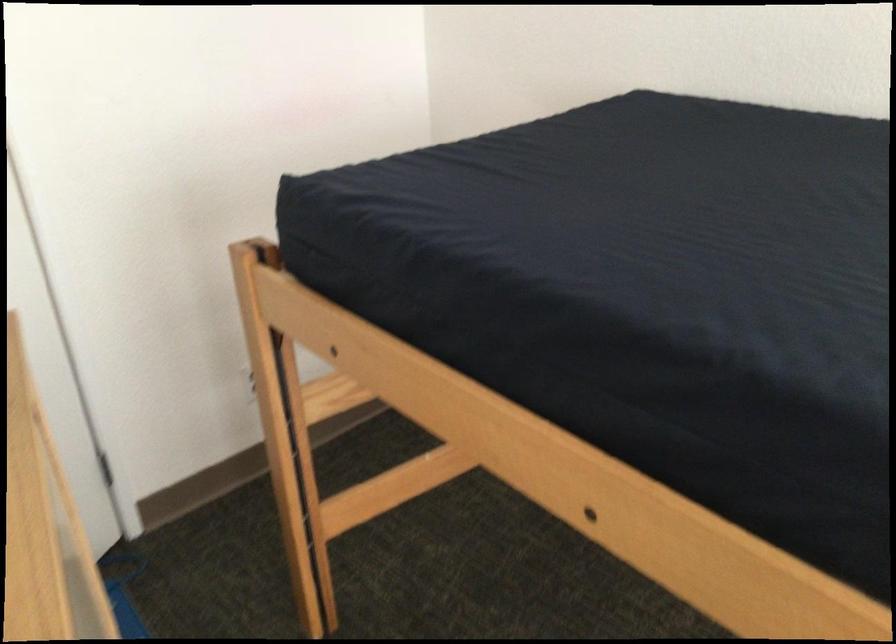
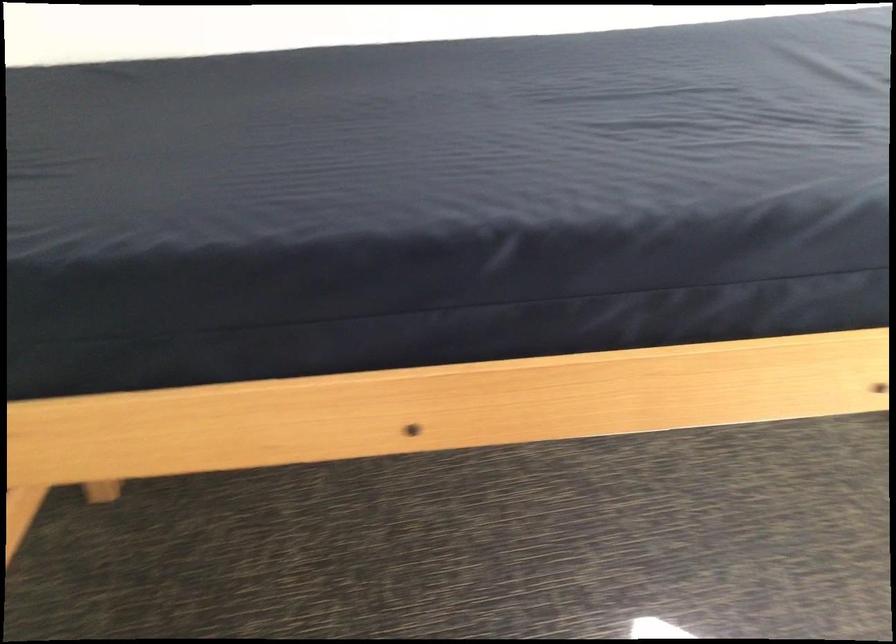
Question: Based on the continuous images, in which direction is the camera rotating? Reply with the corresponding letter.

Choices:
 (A) Left
 (B) Right
 (C) Up
 (D) Down

Answer: (B)